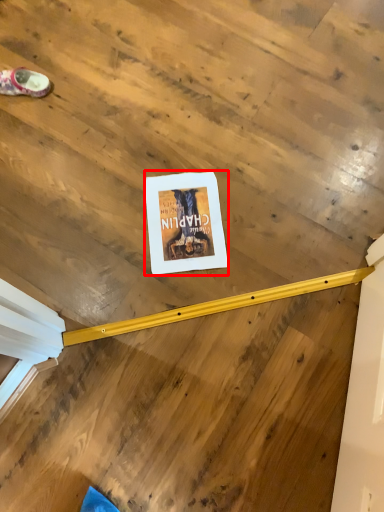
Question: From the image's perspective, where is poster page (annotated by the red box) located in relation to footwear in the image?

Choices:
 (A) below
 (B) above

Answer: (A)